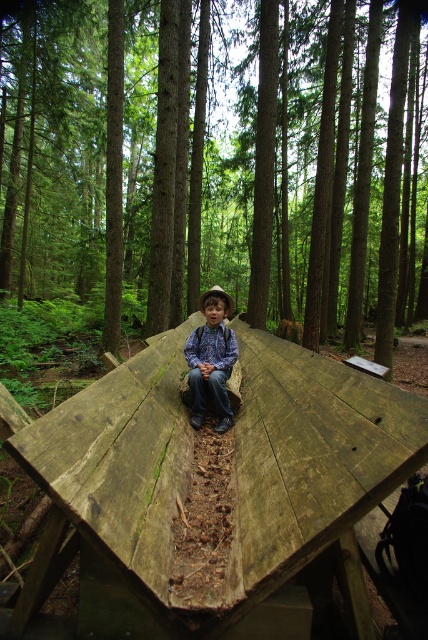
Based on the photo, can you confirm if wooden log at center is taller than wooden plank at center?

Indeed, wooden log at center has a greater height compared to wooden plank at center.

In order to click on wooden log at center in this screenshot , I will do `click(211, 170)`.

Is point (83, 269) positioned behind point (249, 620)?

Yes, it is.

Find the location of a particular element. wooden log at center is located at coordinates (211, 170).

Between point (76, 70) and point (222, 298), which one is positioned behind?

Point (76, 70)

Can you confirm if wooden log at center is thinner than blue denim jeans at center?

No, wooden log at center is not thinner than blue denim jeans at center.

Find the location of a particular element. wooden log at center is located at coordinates (211, 170).

Find the location of a particular element. The image size is (428, 640). wooden log at center is located at coordinates [211, 170].

Which is in front, point (101, 632) or point (222, 301)?

Point (101, 632) is in front.

Can you confirm if wooden plank at center is thinner than blue denim jeans at center?

Incorrect, wooden plank at center's width is not less than blue denim jeans at center's.

Does point (160, 365) come behind point (216, 332)?

No, (160, 365) is closer to viewer.

Find the location of a particular element. The image size is (428, 640). wooden plank at center is located at coordinates (228, 484).